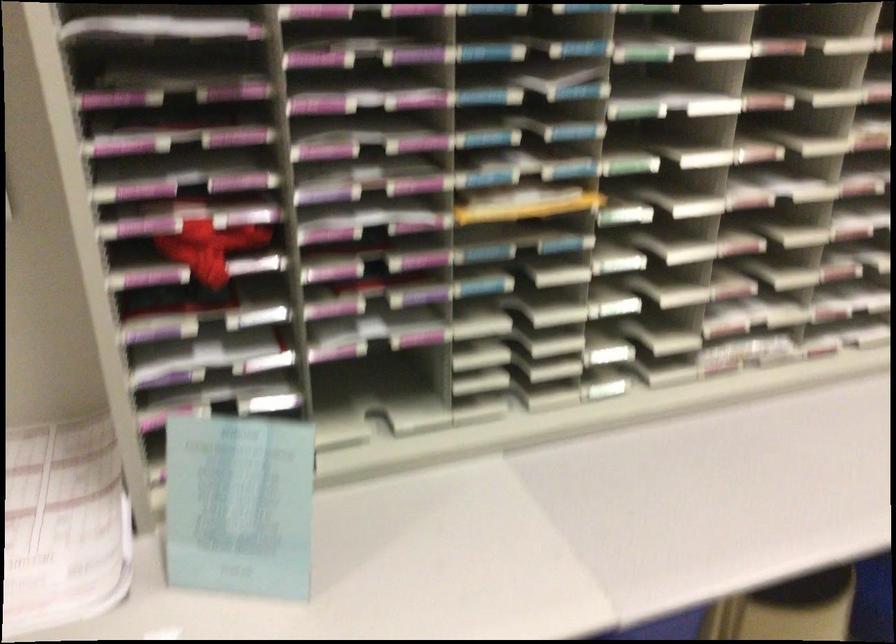
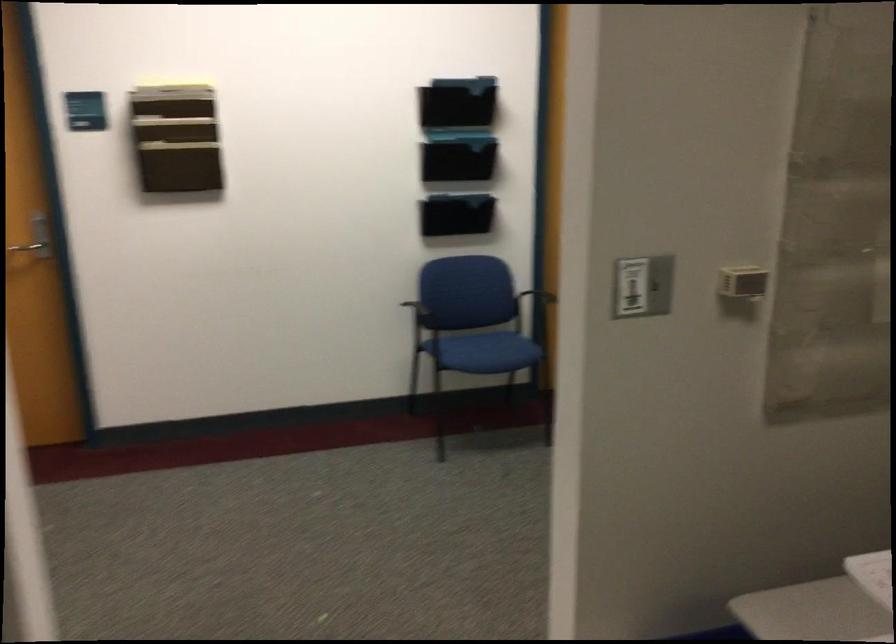
Based on the continuous images, in which direction is the camera rotating?

The camera's rotation is toward left-down.